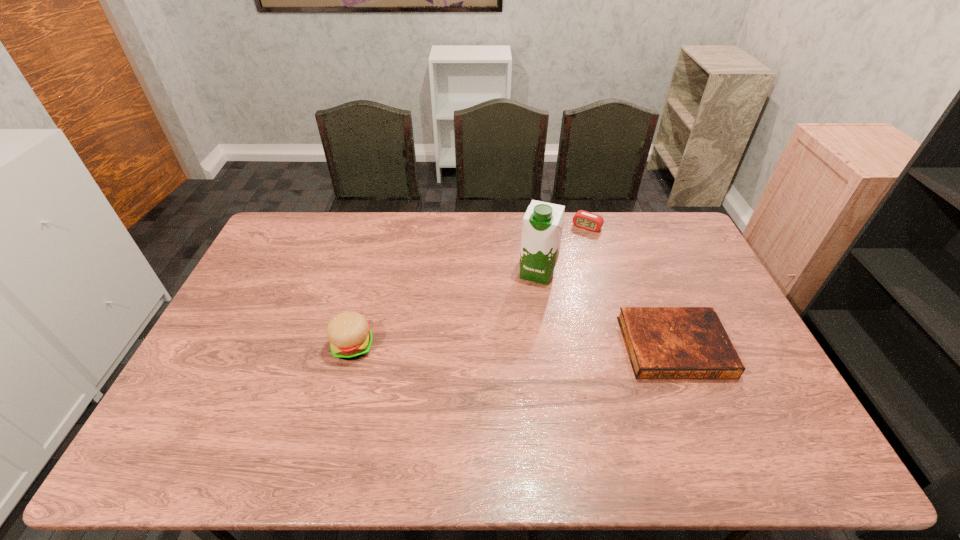
I want to click on vacant area situated 0.050m on the front-facing side of the alarm clock, so click(577, 240).

Locate an element on the screen. The image size is (960, 540). free location located 0.190m on the front-facing side of the tallest object is located at coordinates (516, 327).

Locate an element on the screen. vacant point located 0.110m on the front-facing side of the tallest object is located at coordinates (523, 309).

Identify the location of vacant region located on the front-facing side of the tallest object. This screenshot has width=960, height=540. (495, 380).

Where is `object that is at the far edge`? This screenshot has width=960, height=540. object that is at the far edge is located at coordinates (583, 219).

Identify the location of object that is at the right edge. (662, 342).

This screenshot has height=540, width=960. Find the location of `vacant position at the far edge of the desktop`. vacant position at the far edge of the desktop is located at coordinates (605, 217).

I want to click on vacant space at the near edge of the desktop, so click(x=533, y=407).

Identify the location of free space at the left edge of the desktop. (257, 331).

Where is `free space at the far left corner`? The width and height of the screenshot is (960, 540). free space at the far left corner is located at coordinates click(296, 225).